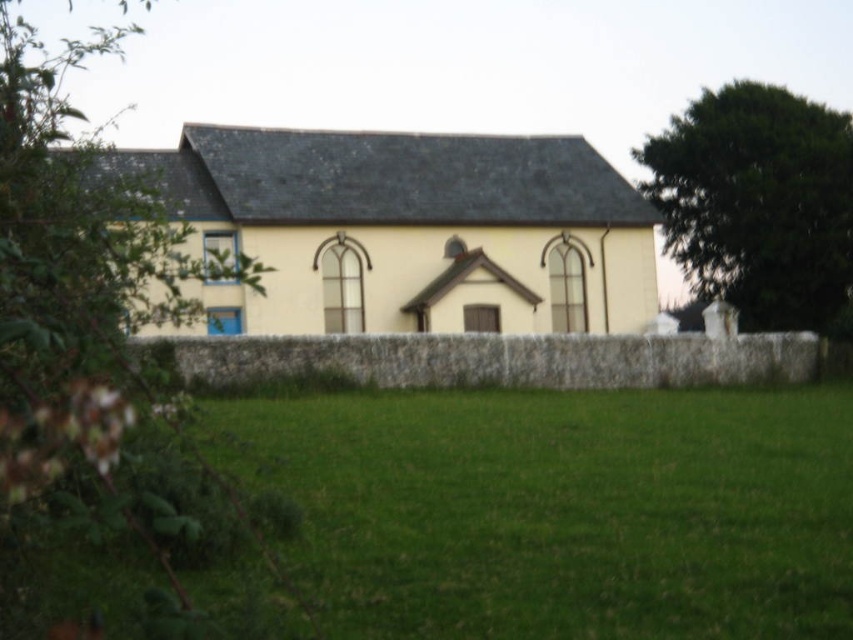
Does yellow matte church at center appear over green leafy tree at left?

Actually, yellow matte church at center is below green leafy tree at left.

Can you confirm if yellow matte church at center is bigger than green leafy tree at left?

No.

Is point (561, 260) positioned behind point (128, 516)?

Yes, it is behind point (128, 516).

Identify the location of yellow matte church at center. The width and height of the screenshot is (853, 640). (408, 228).

Can you confirm if green grass at lower center is positioned below yellow matte church at center?

Correct, green grass at lower center is located below yellow matte church at center.

Who is positioned more to the left, green grass at lower center or yellow matte church at center?

Positioned to the left is yellow matte church at center.

Is point (436, 416) positioned after point (402, 218)?

No.

Image resolution: width=853 pixels, height=640 pixels. What are the coordinates of `green grass at lower center` in the screenshot? It's located at (561, 509).

What do you see at coordinates (561, 509) in the screenshot? I see `green grass at lower center` at bounding box center [561, 509].

Who is higher up, green grass at lower center or green leafy tree at left?

green leafy tree at left

Does point (553, 397) lie in front of point (20, 72)?

No, (553, 397) is further to viewer.

Where is `green grass at lower center`? The image size is (853, 640). green grass at lower center is located at coordinates point(561,509).